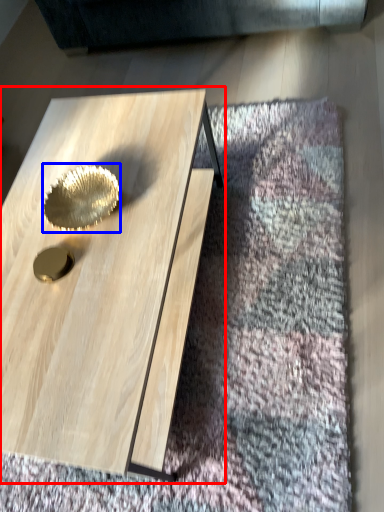
Question: Which point is closer to the camera, coffee table (highlighted by a red box) or gold (highlighted by a blue box)?

Choices:
 (A) coffee table
 (B) gold

Answer: (A)